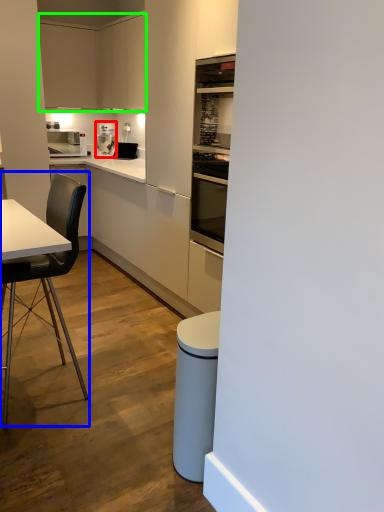
Question: Considering the real-world distances, which object is closest to kitchen appliance (highlighted by a red box)? chair (highlighted by a blue box) or cabinetry (highlighted by a green box).

Choices:
 (A) chair
 (B) cabinetry

Answer: (B)